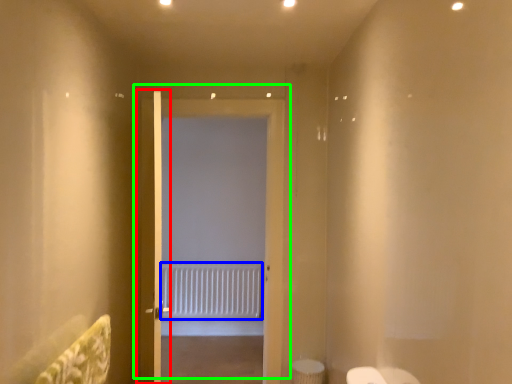
Question: Which object is the closest to the door (highlighted by a red box)? Choose among these: radiator (highlighted by a blue box) or door (highlighted by a green box).

Choices:
 (A) radiator
 (B) door

Answer: (B)